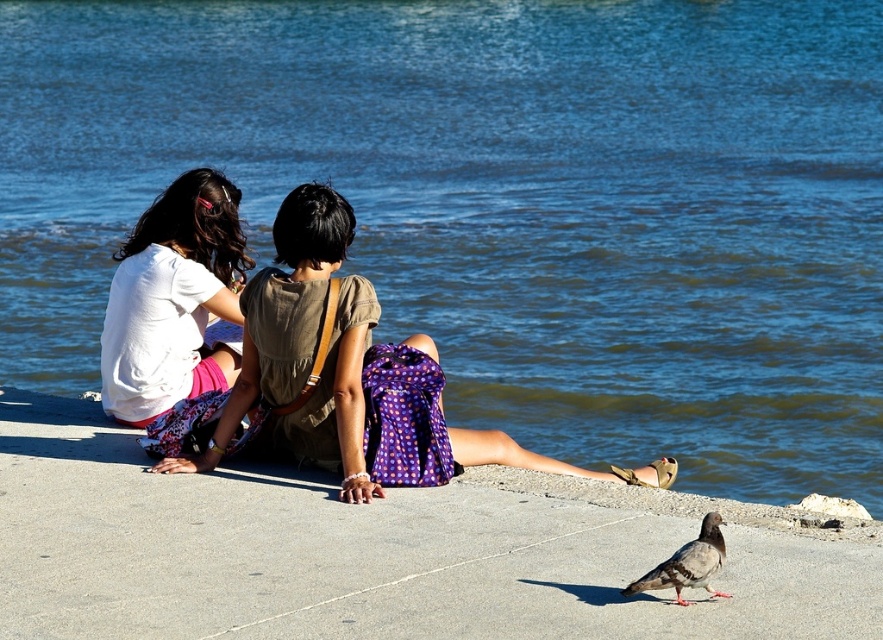
Question: Which point appears closest to the camera in this image?

Choices:
 (A) (663, 564)
 (B) (420, 477)
 (C) (229, 356)

Answer: (A)

Question: Is white cotton shirt at center smaller than gray matte pigeon at lower right?

Choices:
 (A) yes
 (B) no

Answer: (B)

Question: Is the position of white cotton shirt at center more distant than that of white matte shirt at upper left?

Choices:
 (A) yes
 (B) no

Answer: (B)

Question: Among these points, which one is farthest from the camera?

Choices:
 (A) (632, 586)
 (B) (108, 509)

Answer: (B)

Question: Does gray concrete at center appear under white cotton shirt at center?

Choices:
 (A) no
 (B) yes

Answer: (B)

Question: Which point appears closest to the camera in this image?

Choices:
 (A) (646, 577)
 (B) (121, 300)

Answer: (A)